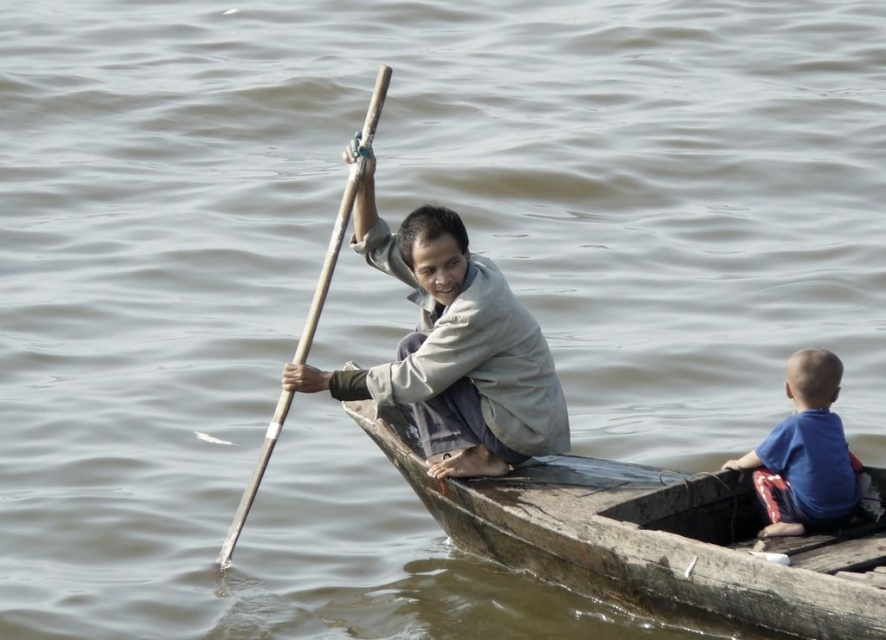
Question: Can you confirm if wooden boat at center is smaller than wooden smooth paddle at center?

Choices:
 (A) yes
 (B) no

Answer: (A)

Question: Which is nearer to the wooden smooth paddle at center?

Choices:
 (A) blue cotton shirt at right
 (B) blue cotton shirt at upper center

Answer: (B)

Question: Is wooden boat at center further to the viewer compared to blue cotton shirt at upper center?

Choices:
 (A) no
 (B) yes

Answer: (A)

Question: Which point is farther to the camera?

Choices:
 (A) (633, 472)
 (B) (461, 317)

Answer: (A)

Question: Which point is farther to the camera?

Choices:
 (A) (307, 330)
 (B) (786, 381)
 (C) (702, 506)
 (D) (422, 227)

Answer: (A)

Question: Is wooden boat at center smaller than blue cotton shirt at upper center?

Choices:
 (A) no
 (B) yes

Answer: (A)